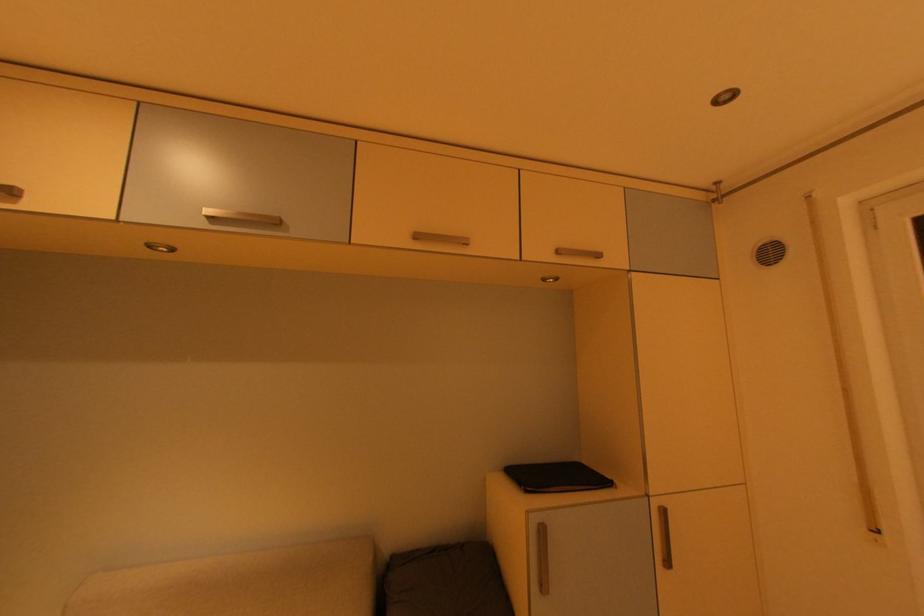
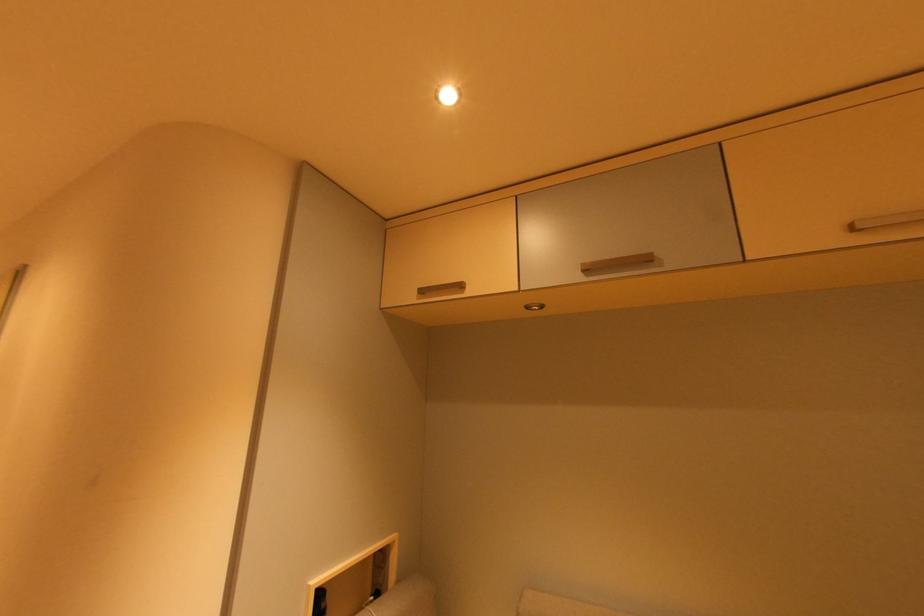
Question: The camera is either moving clockwise (left) or counter-clockwise (right) around the object. The first image is from the beginning of the video and the second image is from the end. Is the camera moving left or right when shooting the video?

Choices:
 (A) Left
 (B) Right

Answer: (B)